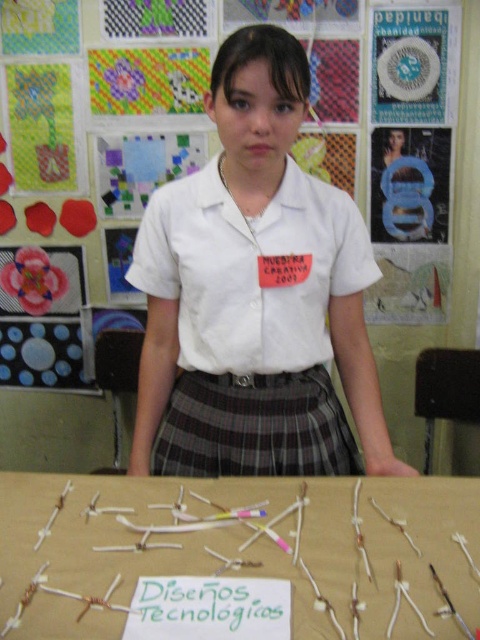
Question: Which point is farther from the camera taking this photo?

Choices:
 (A) (327, 412)
 (B) (178, 224)
 (C) (57, 522)

Answer: (A)

Question: Is white plaid skirt at center smaller than plaid fabric skirt at center?

Choices:
 (A) no
 (B) yes

Answer: (A)

Question: Which point is closer to the camera taking this photo?

Choices:
 (A) (192, 332)
 (B) (83, 602)
 (C) (169, 429)
 (D) (256, 348)

Answer: (B)

Question: Which of the following is the closest to the observer?

Choices:
 (A) white plastic sticks at center
 (B) white cotton shirt at center
 (C) white plaid skirt at center

Answer: (A)

Question: Can you confirm if white cotton shirt at center is wider than plaid fabric skirt at center?

Choices:
 (A) yes
 (B) no

Answer: (A)

Question: Can you confirm if white plaid skirt at center is smaller than plaid fabric skirt at center?

Choices:
 (A) yes
 (B) no

Answer: (B)